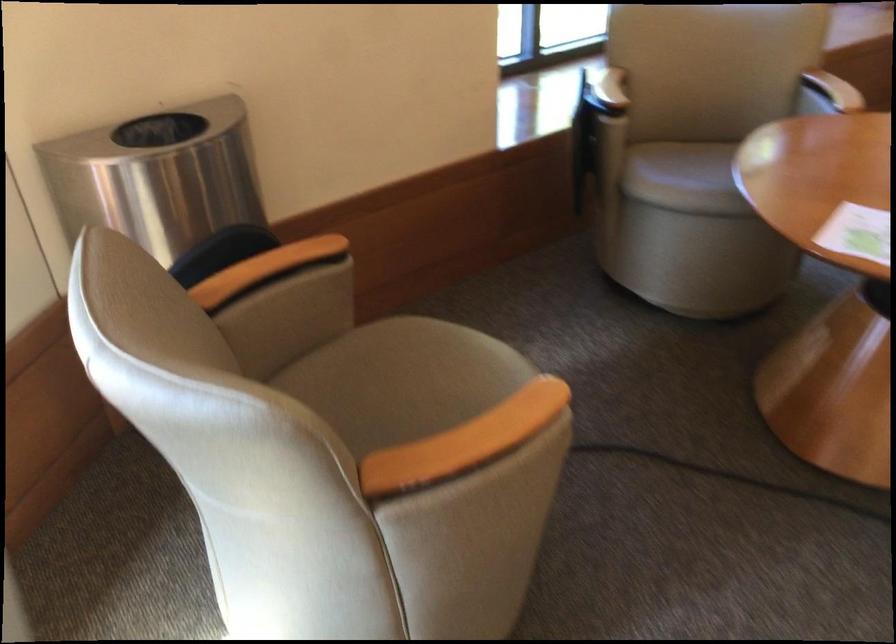
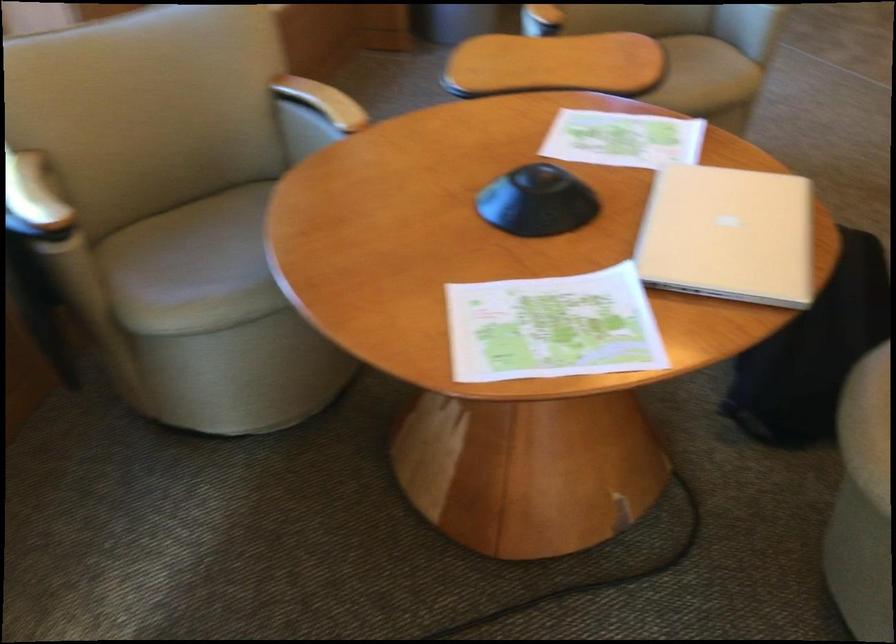
Question: The camera is either moving clockwise (left) or counter-clockwise (right) around the object. The first image is from the beginning of the video and the second image is from the end. Is the camera moving left or right when shooting the video?

Choices:
 (A) Left
 (B) Right

Answer: (A)